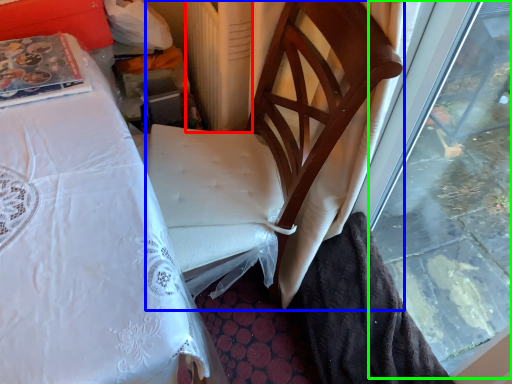
Question: Which object is the closest to the radiator (highlighted by a red box)? Choose among these: chair (highlighted by a blue box) or window (highlighted by a green box).

Choices:
 (A) chair
 (B) window

Answer: (A)